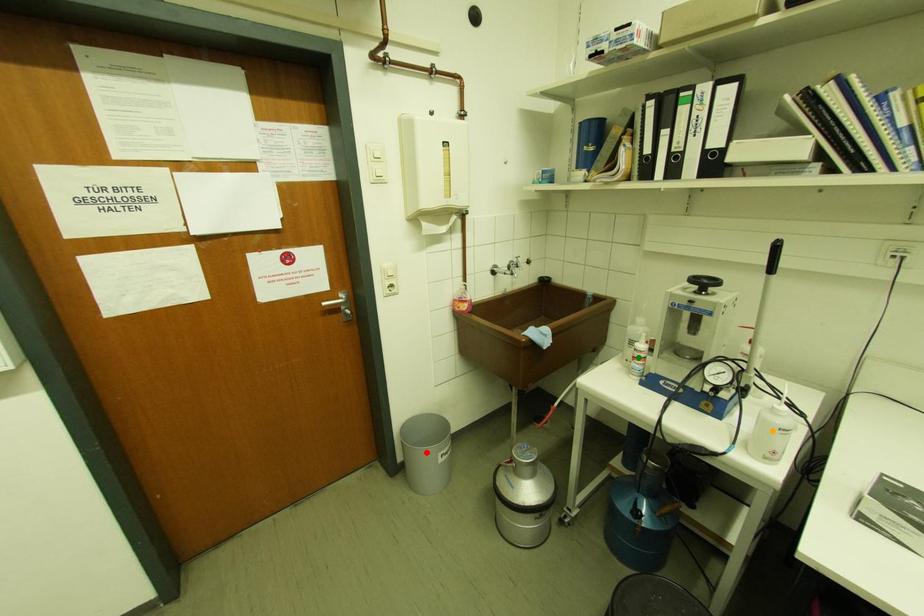
Order these from nearest to farthest:
- red point
- orange point
- green point

orange point → red point → green point